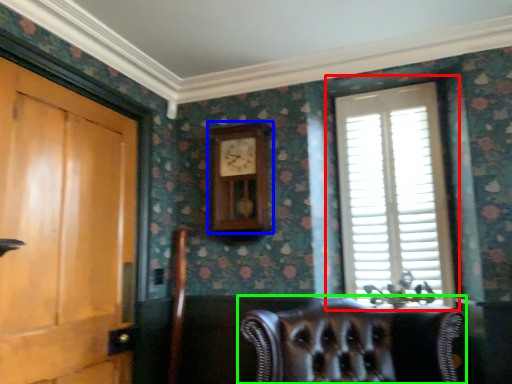
Question: Which object is positioned farthest from window (highlighted by a red box)? Select from clock (highlighted by a blue box) and chair (highlighted by a green box).

Choices:
 (A) clock
 (B) chair

Answer: (B)